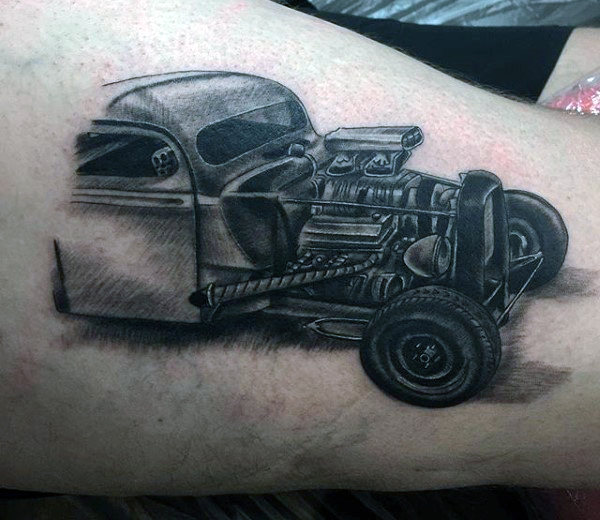
This screenshot has height=520, width=600. What are the coordinates of `door` in the screenshot? It's located at (124, 251).